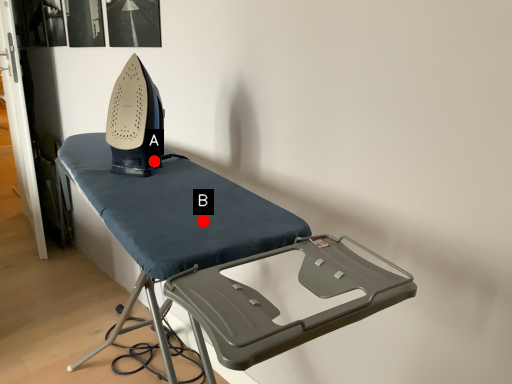
Question: Two points are circled on the image, labeled by A and B beside each circle. Which point is farther from the camera taking this photo?

Choices:
 (A) A is further
 (B) B is further

Answer: (A)